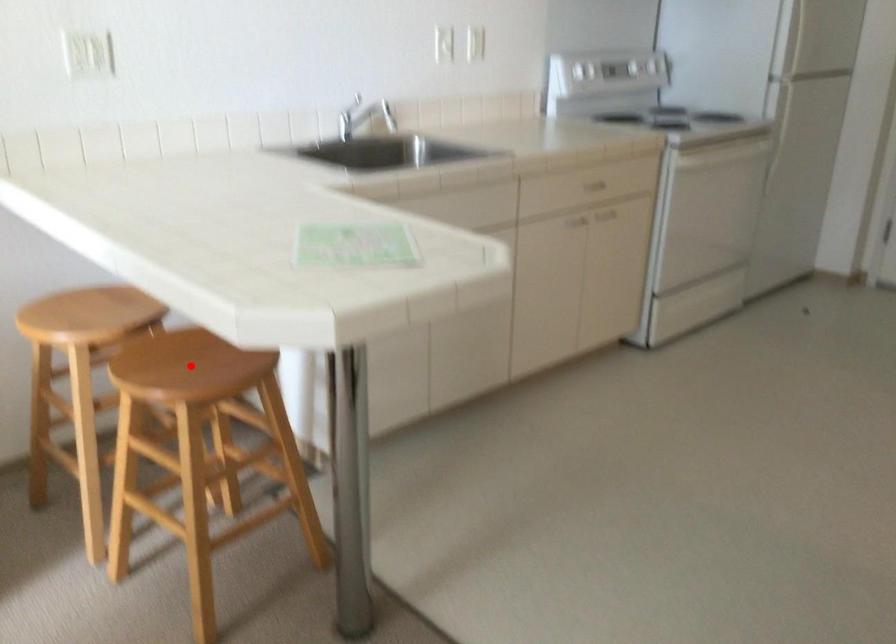
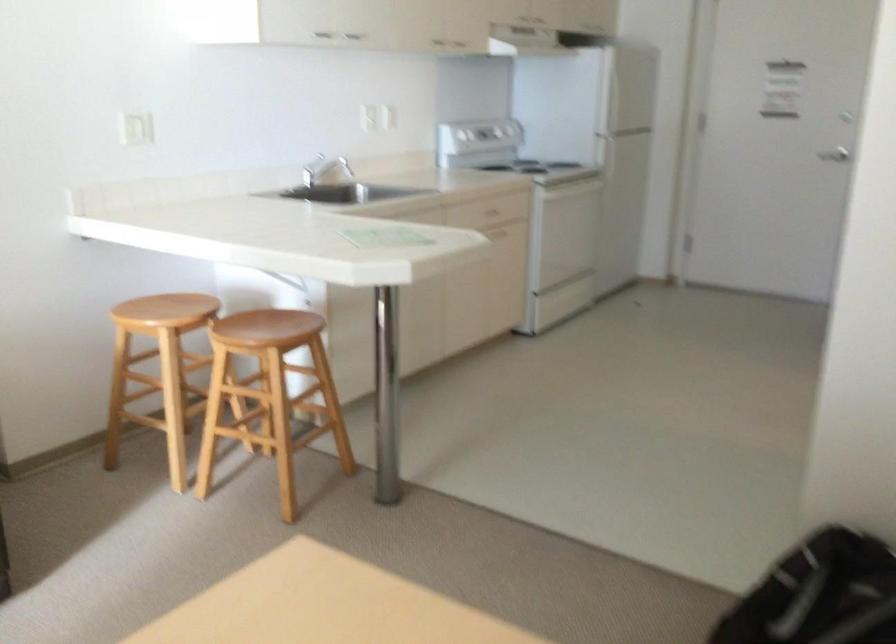
Question: I am providing you with two images of the same scene from different viewpoints. In image1, a red point is highlighted. Considering the same 3D point in image2, which of the following is correct?

Choices:
 (A) It is closer
 (B) It is farther

Answer: (B)